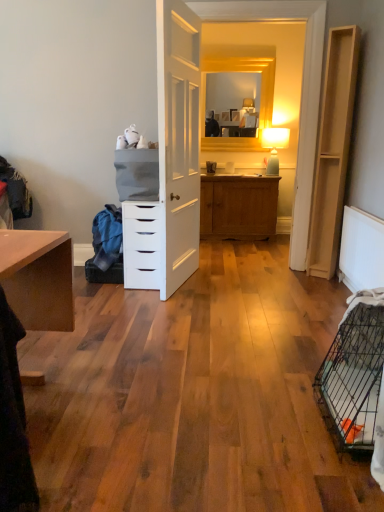
Locate an element on the screen. blank area to the left of black wire birdcage at lower right is located at coordinates (268, 426).